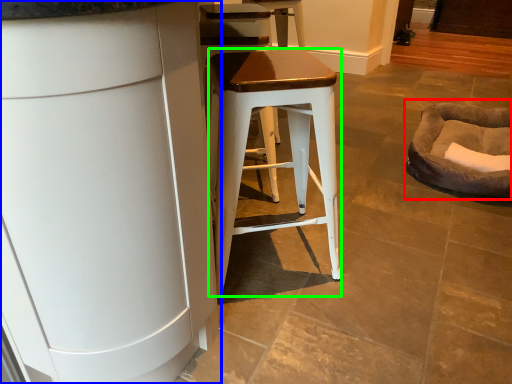
Question: Which is farther away from bean bag chair (highlighted by a red box)? cabinetry (highlighted by a blue box) or stool (highlighted by a green box)?

Choices:
 (A) cabinetry
 (B) stool

Answer: (A)